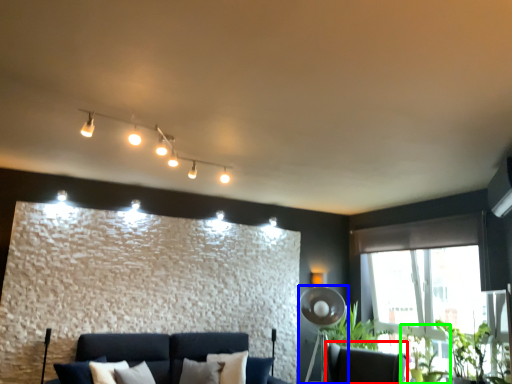
Question: Which is farther away from swivel chair (highlighted by a red box)? fan (highlighted by a blue box) or plant (highlighted by a green box)?

Choices:
 (A) fan
 (B) plant

Answer: (A)